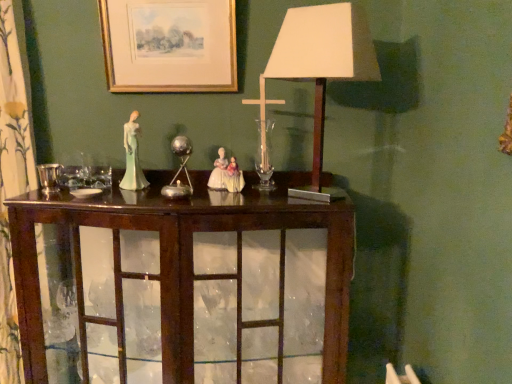
At what (x,y) coordinates should I click in order to perform the action: click on vacant region to the right of shiny silver candle holder at left, the 1th candle holder from the front. Please return your answer as a coordinate pair (x, y). The height and width of the screenshot is (384, 512). Looking at the image, I should click on (105, 192).